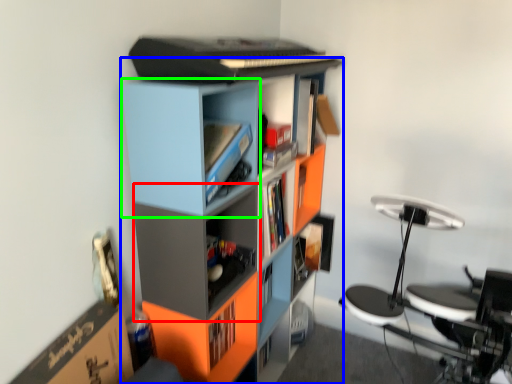
Question: Which object is positioned closest to shelf (highlighted by a red box)? Select from bookcase (highlighted by a blue box) and cabinet (highlighted by a green box).

Choices:
 (A) bookcase
 (B) cabinet

Answer: (A)